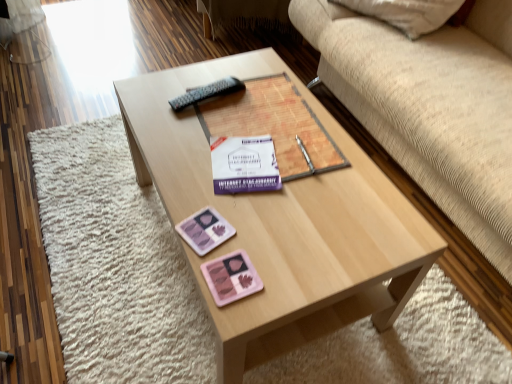
Locate an element on the screen. The image size is (512, 384). vacant region under purple matte book at center (from a real-world perspective) is located at coordinates (266, 125).